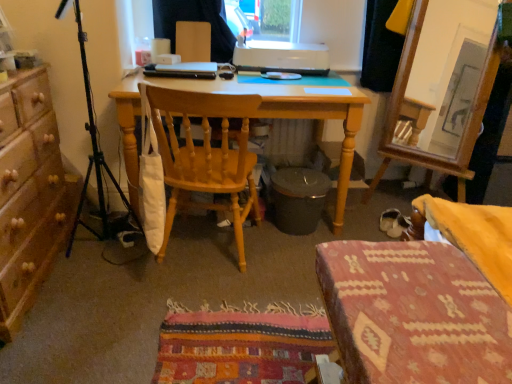
Where is `vacant space positioned to the left of dark gray plastic trash bin/can at center`? This screenshot has height=384, width=512. vacant space positioned to the left of dark gray plastic trash bin/can at center is located at coordinates (252, 229).